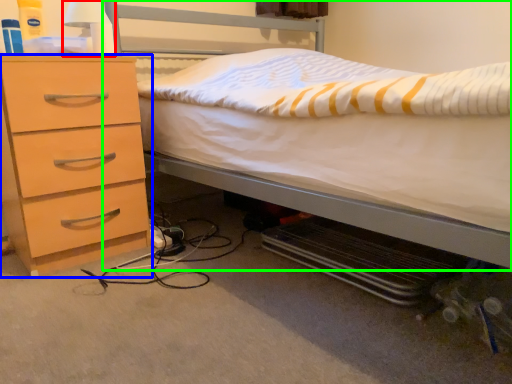
Question: Based on their relative distances, which object is nearer to bedside lamp (highlighted by a red box)? Choose from chest of drawers (highlighted by a blue box) and bed (highlighted by a green box).

Choices:
 (A) chest of drawers
 (B) bed

Answer: (A)